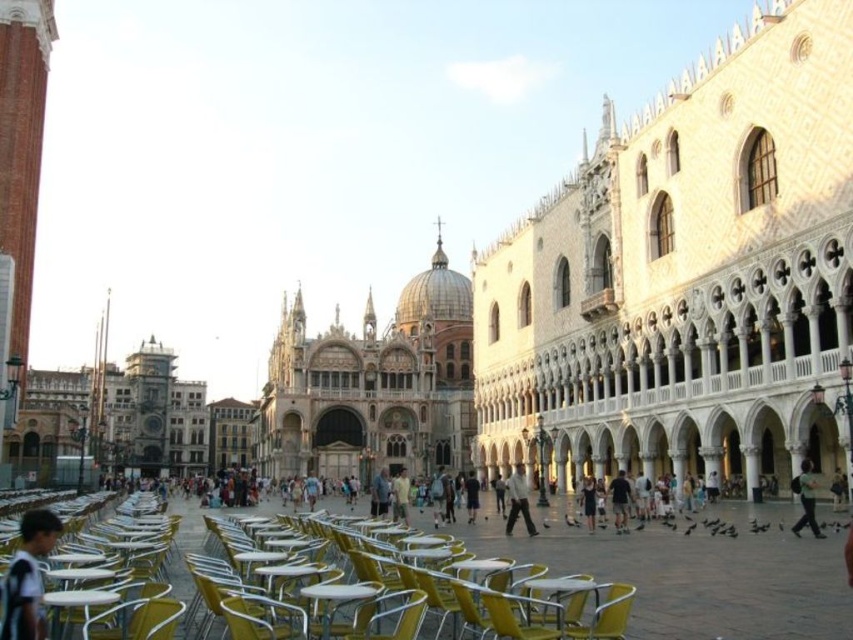
Question: Which point appears farthest from the camera in this image?

Choices:
 (A) (546, 525)
 (B) (50, 628)
 (C) (329, 589)
 (D) (273, 385)

Answer: (D)

Question: Which of these objects is positioned farthest from the metallic yellow table at center?

Choices:
 (A) yellow plastic chair at lower center
 (B) dark blue jeans at center
 (C) black matte pigeon at center
 (D) yellow plastic table at lower center

Answer: (B)

Question: Can you confirm if yellow plastic chair at lower left is positioned below black matte pigeon at center?

Choices:
 (A) yes
 (B) no

Answer: (B)

Question: Among these points, which one is nearest to the camera?

Choices:
 (A) (271, 556)
 (B) (567, 520)
 (C) (593, 586)
 (D) (312, 442)

Answer: (C)

Question: Does yellow plastic chair at lower left have a greater width compared to yellow plastic table at lower center?

Choices:
 (A) yes
 (B) no

Answer: (A)

Question: Does yellow plastic chair at lower center appear under yellow plastic table at center?

Choices:
 (A) no
 (B) yes

Answer: (B)